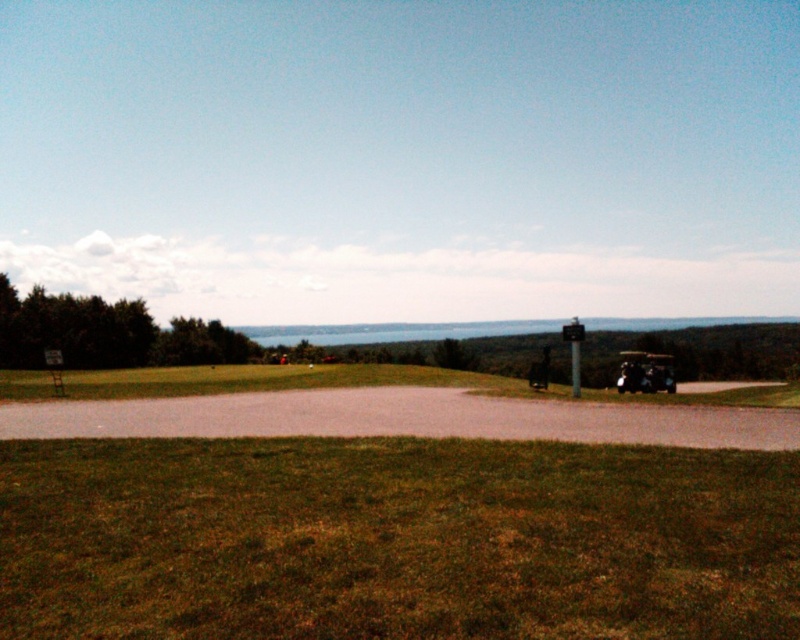
You are standing at the point with coordinates point (637, 388) and want to walk to the point with coordinates point (726, 477). Which direction should you move relative to your current position?

You should move forward because point (726, 477) is in front of point (637, 388).

You are standing at the origin point of the coordinate system in this image. The origin is at the bottom left corner of the image. You want to walk to the green grass at lower center. What direction should you walk in? Please provide your answer in terms of the coordinate system direction.

Since the green grass at lower center is located at coordinate point (394, 540), you should walk towards the right and slightly upwards from the origin to reach it.